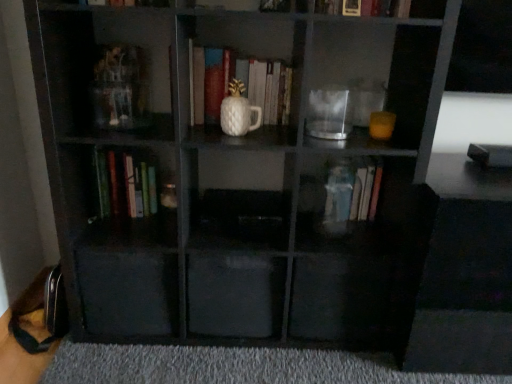
Question: Does gray carpet at lower center have a smaller size compared to white matte vase at center, which is the second book from left to right?

Choices:
 (A) yes
 (B) no

Answer: (B)

Question: Is gray carpet at lower center positioned with its back to white matte vase at center, acting as the third book starting from the right?

Choices:
 (A) yes
 (B) no

Answer: (B)

Question: From the image's perspective, is gray carpet at lower center located beneath white matte vase at center, acting as the third book starting from the right?

Choices:
 (A) yes
 (B) no

Answer: (A)

Question: Could you tell me if gray carpet at lower center is turned towards white matte vase at center, acting as the third book starting from the right?

Choices:
 (A) yes
 (B) no

Answer: (B)

Question: Can you confirm if gray carpet at lower center is taller than white matte vase at center, which is the second book from left to right?

Choices:
 (A) no
 (B) yes

Answer: (A)

Question: In terms of size, does transparent plastic drawer at lower left, which is the second drawer from right to left, appear bigger or smaller than transparent glass jar at center?

Choices:
 (A) small
 (B) big

Answer: (B)

Question: Is transparent plastic drawer at lower left, which is the second drawer from right to left, in front of or behind transparent glass jar at center in the image?

Choices:
 (A) front
 (B) behind

Answer: (B)

Question: Is transparent plastic drawer at lower left, the 1th drawer when ordered from left to right, taller or shorter than transparent glass jar at center?

Choices:
 (A) tall
 (B) short

Answer: (A)

Question: Is point (106, 297) closer or farther from the camera than point (330, 110)?

Choices:
 (A) farther
 (B) closer

Answer: (A)

Question: From their relative heights in the image, would you say transparent plastic book at center, the first book positioned from the right, is taller or shorter than transparent plastic drawer at lower left, the 1th drawer when ordered from left to right?

Choices:
 (A) tall
 (B) short

Answer: (B)

Question: Is transparent plastic book at center, the first book positioned from the right, inside the boundaries of transparent plastic drawer at lower left, the 1th drawer when ordered from left to right, or outside?

Choices:
 (A) inside
 (B) outside

Answer: (B)

Question: Considering the positions of point (350, 215) and point (131, 271), is point (350, 215) closer or farther from the camera than point (131, 271)?

Choices:
 (A) closer
 (B) farther

Answer: (B)

Question: Would you say transparent plastic book at center, the first book positioned from the right, is to the left or to the right of transparent plastic drawer at lower left, which is the second drawer from right to left, in the picture?

Choices:
 (A) right
 (B) left

Answer: (A)

Question: Considering the positions of transparent glass jar at center and transparent plastic drawer at lower left, which is the second drawer from right to left, in the image, is transparent glass jar at center wider or thinner than transparent plastic drawer at lower left, which is the second drawer from right to left,?

Choices:
 (A) thin
 (B) wide

Answer: (A)

Question: In the image, is transparent glass jar at center on the left side or the right side of transparent plastic drawer at lower left, the 1th drawer when ordered from left to right?

Choices:
 (A) right
 (B) left

Answer: (A)